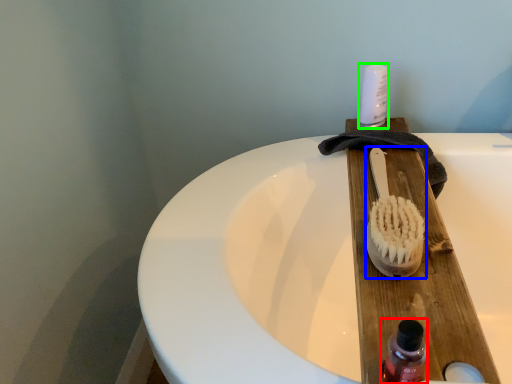
Question: Considering the real-world distances, which object is closest to bottle (highlighted by a red box)? brush (highlighted by a blue box) or toiletry (highlighted by a green box).

Choices:
 (A) brush
 (B) toiletry

Answer: (A)